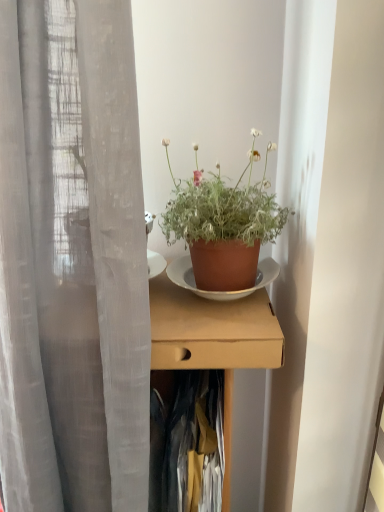
Identify the location of free area below terracotta pot at center (from a real-world perspective). This screenshot has width=384, height=512. (226, 307).